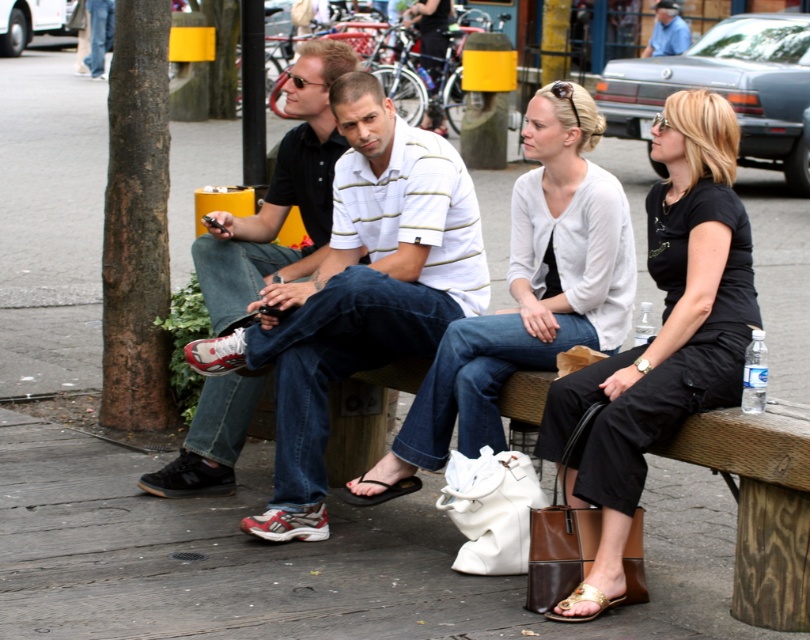
Question: Observing the image, what is the correct spatial positioning of brown woven bench at lower center in reference to black metal pole at upper center?

Choices:
 (A) left
 (B) right

Answer: (B)

Question: Estimate the real-world distances between objects in this image. Which object is farther from the matte black sneakers at left?

Choices:
 (A) matte white sweater at center
 (B) gold metallic sandal at lower center

Answer: (B)

Question: Which of the following is the farthest from the observer?

Choices:
 (A) (680, 51)
 (B) (250, 236)
 (C) (254, 67)
 (D) (783, 563)

Answer: (A)

Question: Is black cargo pants at center wider than black rubber sandal at lower center?

Choices:
 (A) no
 (B) yes

Answer: (B)

Question: Is black cargo pants at center smaller than gold metallic sandal at lower center?

Choices:
 (A) no
 (B) yes

Answer: (A)

Question: Which point is closer to the camera?

Choices:
 (A) (501, 368)
 (B) (261, 116)
 (C) (676, 38)

Answer: (A)